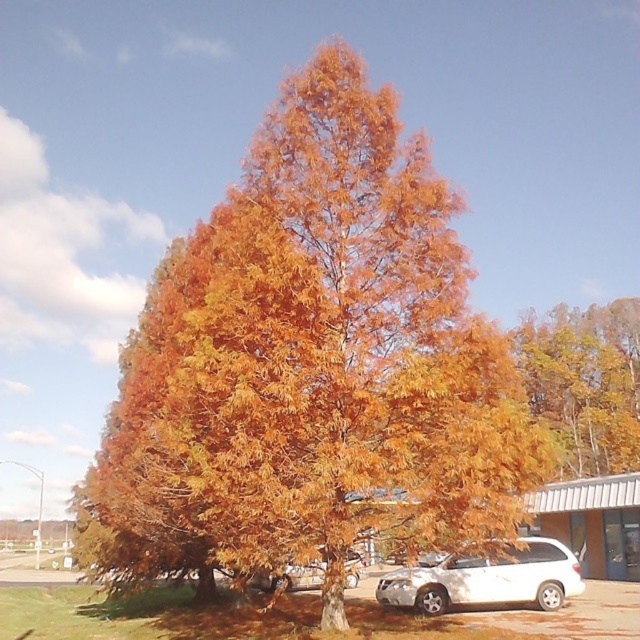
Is orange leafy tree at center thinner than orange matte tree at upper right?

No.

Can you confirm if orange leafy tree at center is positioned below orange matte tree at upper right?

Incorrect, orange leafy tree at center is not positioned below orange matte tree at upper right.

The width and height of the screenshot is (640, 640). Identify the location of orange leafy tree at center. (316, 365).

Who is higher up, orange leafy tree at center or satin silver car at center?

orange leafy tree at center

Does point (502, 355) come behind point (346, 554)?

That is False.

You are a GUI agent. You are given a task and a screenshot of the screen. Output one action in this format:
    pyautogui.click(x=<x>, y=<y>)
    Task: Click on the orange leafy tree at center
    The height and width of the screenshot is (640, 640).
    Given the screenshot: What is the action you would take?
    pyautogui.click(x=316, y=365)

Identify the location of orange leafy tree at center. Image resolution: width=640 pixels, height=640 pixels. (316, 365).

Can you confirm if orange matte tree at upper right is positioned above white matte van at lower right?

Correct, orange matte tree at upper right is located above white matte van at lower right.

In the scene shown: Who is positioned more to the left, orange matte tree at upper right or white matte van at lower right?

From the viewer's perspective, white matte van at lower right appears more on the left side.

The width and height of the screenshot is (640, 640). In order to click on orange matte tree at upper right in this screenshot , I will do `click(586, 381)`.

Where is `orange matte tree at upper right`? orange matte tree at upper right is located at coordinates (586, 381).